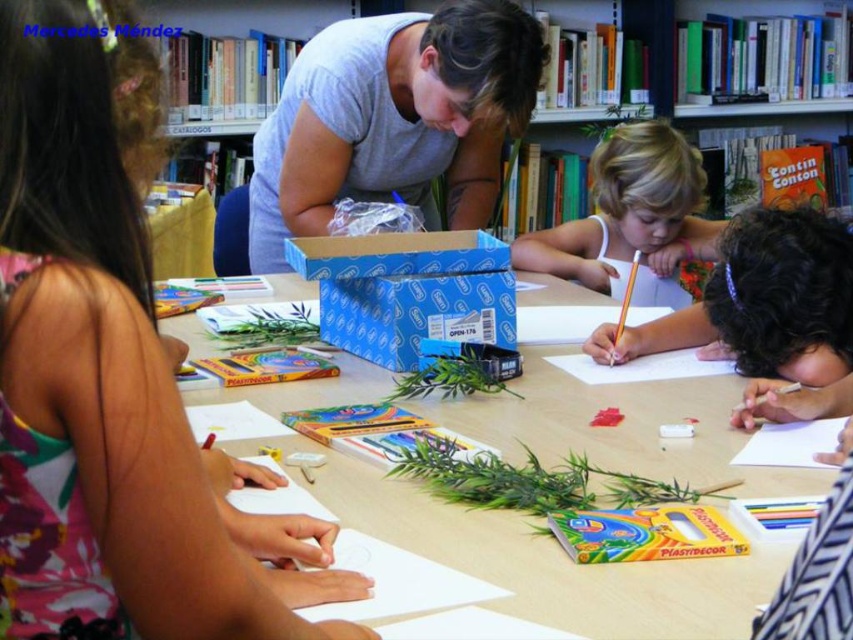
You are standing in the library and want to reach the wooden table at center to retrieve an item. However, there is a child with blonde hair at center in your way. Based on the spatial arrangement, can you walk around the child to access the table?

The wooden table at center is closer to the viewer than blonde hair at center, meaning the table is between you and the child. Since the table is already in front of the child, you can directly approach the table without needing to walk around the child.

You are standing at the table in the library scene. There are two points marked on the table surface. The first point is at coordinate point (196, 556) and the second is at point (643, 419). If you want to move an object from the first point to the second point, which direction should you move it relative to your position facing the table?

The first point (196, 556) is in front of the second point (643, 419). To move the object from the first point to the second point, you would need to move it backward towards the back of the table relative to your position facing the table.

You are a teacher trying to organize the classroom. You need to place a 12 inch ruler between the wooden table at center and the blonde hair at center. Is there enough space to fit the ruler without moving any items?

The wooden table at center is 33.67 inches from blonde hair at center, so yes, there is enough space to fit a 12 inch ruler between them without moving any items.